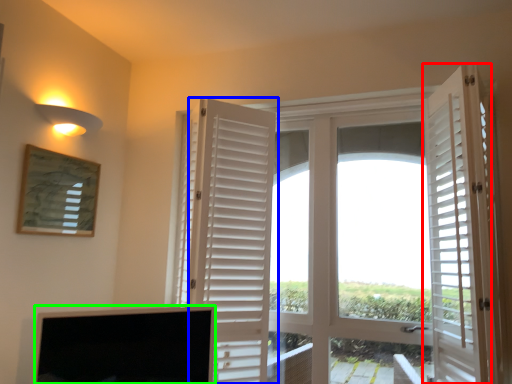
Question: Considering the real-world distances, which object is farthest from door (highlighted by a red box)? door (highlighted by a blue box) or screen (highlighted by a green box)?

Choices:
 (A) door
 (B) screen

Answer: (B)